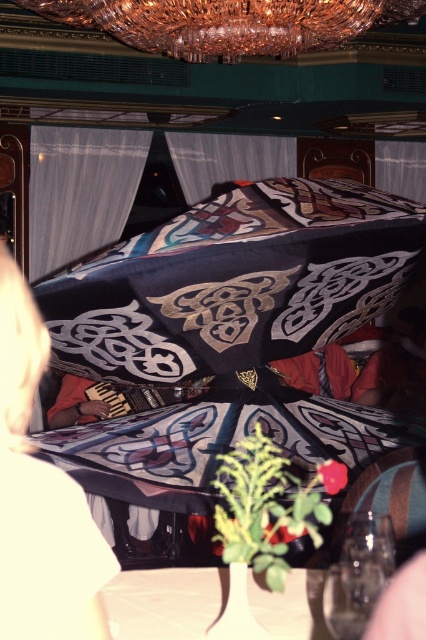
Question: Which of the following is the closest to the observer?

Choices:
 (A) (227, 157)
 (B) (77, 45)

Answer: (B)

Question: Which point is farther to the camera?

Choices:
 (A) matte black umbrella at lower right
 (B) crystal glass chandelier at upper center

Answer: (B)

Question: Can you confirm if crystal glass chandelier at upper center is positioned below matte black umbrella at lower right?

Choices:
 (A) yes
 (B) no

Answer: (B)

Question: Which point is farther to the camera?

Choices:
 (A) crystal glass chandelier at upper center
 (B) matte black umbrella at lower right
 (C) silky black umbrella at center
 (D) silky gray curtain at center

Answer: (D)

Question: Can you confirm if silky black umbrella at center is wider than silky patterned cloth at center?

Choices:
 (A) yes
 (B) no

Answer: (B)

Question: Is silky black umbrella at center wider than silky gray curtain at center?

Choices:
 (A) yes
 (B) no

Answer: (A)